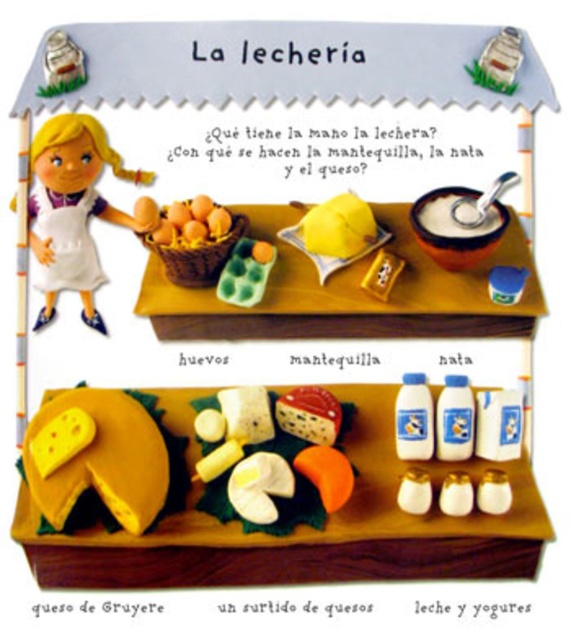
Image resolution: width=571 pixels, height=640 pixels. What do you see at coordinates (246, 273) in the screenshot? I see `green plastic eggs at center` at bounding box center [246, 273].

This screenshot has height=640, width=571. What are the coordinates of `green plastic eggs at center` in the screenshot? It's located at (246, 273).

Is point (242, 276) positioned after point (54, 44)?

Yes.

I want to click on green plastic eggs at center, so click(246, 273).

Based on the photo, which is below, yellow matte lemon at center or white crumbly cheese at center?

white crumbly cheese at center is below.

At what (x,y) coordinates should I click in order to perform the action: click on yellow matte lemon at center. Please return your answer as a coordinate pair (x, y). Image resolution: width=571 pixels, height=640 pixels. Looking at the image, I should click on click(x=339, y=227).

Is yellow matte lemon at center smaller than white plastic milk jug at upper left?

No.

Is yellow matte lemon at center further to the viewer compared to white plastic milk jug at upper left?

Yes, yellow matte lemon at center is behind white plastic milk jug at upper left.

Identify the location of yellow matte lemon at center. Image resolution: width=571 pixels, height=640 pixels. (339, 227).

The height and width of the screenshot is (640, 571). What are the coordinates of `yellow matte lemon at center` in the screenshot? It's located at (339, 227).